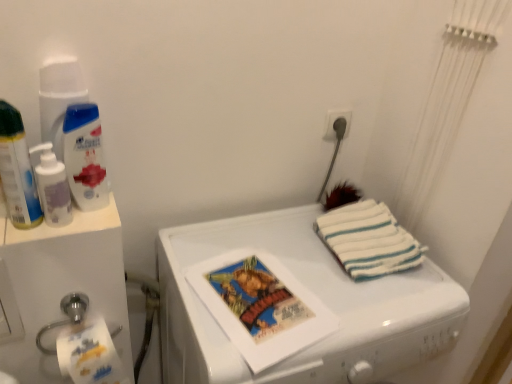
Question: Based on their sizes in the image, would you say white glossy washing machine at center is bigger or smaller than white plastic socket at upper right?

Choices:
 (A) small
 (B) big

Answer: (B)

Question: Is white glossy washing machine at center to the left or to the right of white plastic socket at upper right in the image?

Choices:
 (A) left
 (B) right

Answer: (A)

Question: Which is farther from the white striped towel at right?

Choices:
 (A) white glossy washing machine at center
 (B) white plastic socket at upper right
 (C) translucent plastic pump bottle at left, the 2th cleaning product in the right-to-left sequence
 (D) white glossy shampoo at upper left, which is the first cleaning product in right-to-left order
 (E) matte plastic spray can at left

Answer: (E)

Question: Estimate the real-world distances between objects in this image. Which object is closer to the white plastic water cooler at left?

Choices:
 (A) white glossy washing machine at center
 (B) translucent plastic pump bottle at left, the 2th cleaning product in the right-to-left sequence
 (C) white striped towel at right
 (D) white glossy shampoo at upper left, which is the first cleaning product in right-to-left order
 (E) white plastic socket at upper right

Answer: (B)